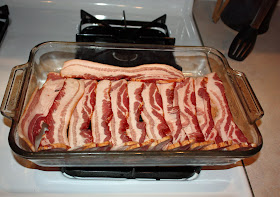
Identify the location of baking dish. The width and height of the screenshot is (280, 197). (172, 161).